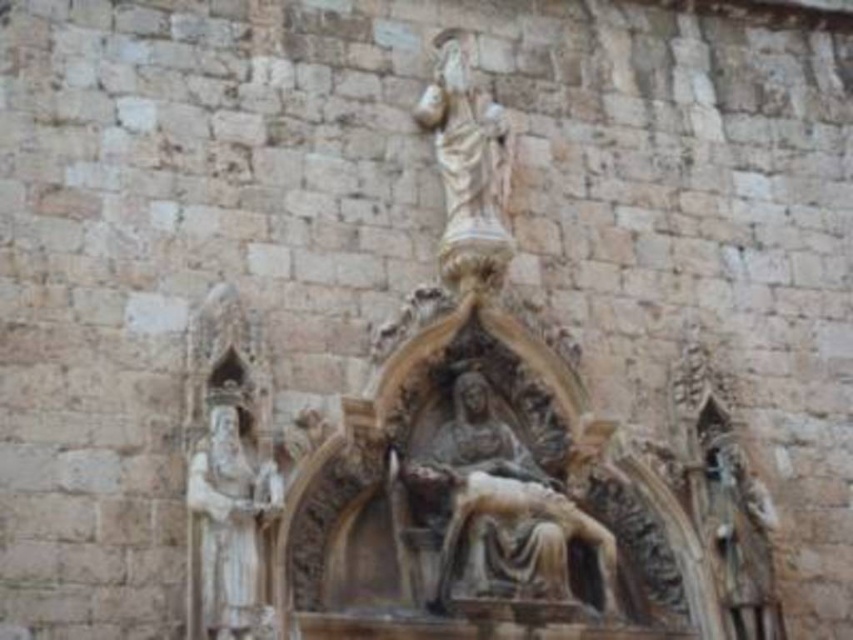
You are an art historian examining the stone wall. You notice the polished stone pieta at center and the white stone statue at left. Which of these two sculptures is positioned closer to the right side of the wall?

The polished stone pieta at center is positioned closer to the right side of the wall compared to the white stone statue at left.

You are an art conservator examining the stone wall. You need to clean both the polished stone pieta at center and the white stone statue at left. Which statue should you clean first if you want to start with the one that is farther from the viewer?

The white stone statue at left is behind the polished stone pieta at center, so it is farther from the viewer. Therefore, you should clean the white stone statue at left first.